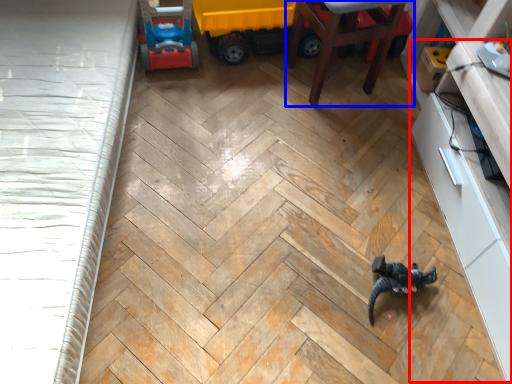
Question: Among these objects, which one is farthest to the camera, dresser (highlighted by a red box) or furniture (highlighted by a blue box)?

Choices:
 (A) dresser
 (B) furniture

Answer: (B)